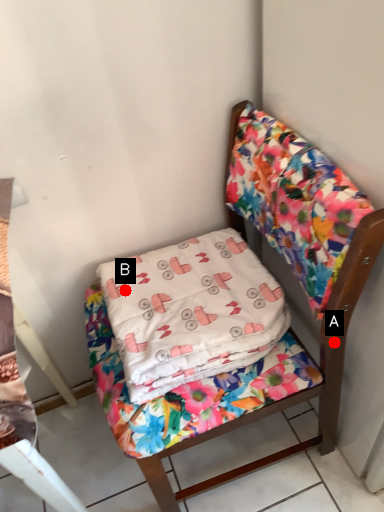
Question: Two points are circled on the image, labeled by A and B beside each circle. Which point is farther from the camera taking this photo?

Choices:
 (A) A is further
 (B) B is further

Answer: (B)